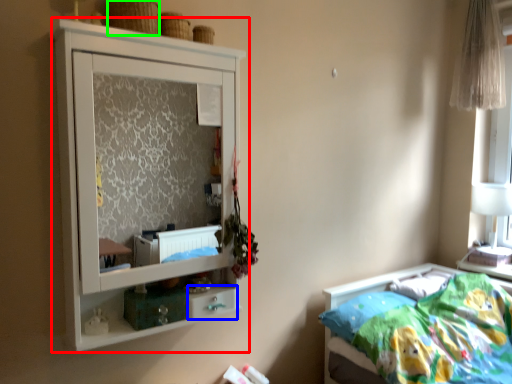
Question: Which object is positioned farthest from cupboard (highlighted by a red box)? Select from drawer (highlighted by a blue box) and basket (highlighted by a green box).

Choices:
 (A) drawer
 (B) basket

Answer: (A)